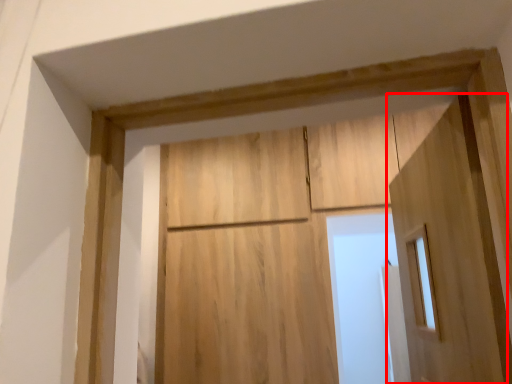
Question: From the image's perspective, where is door (annotated by the red box) located in relation to barn door in the image?

Choices:
 (A) above
 (B) below

Answer: (A)